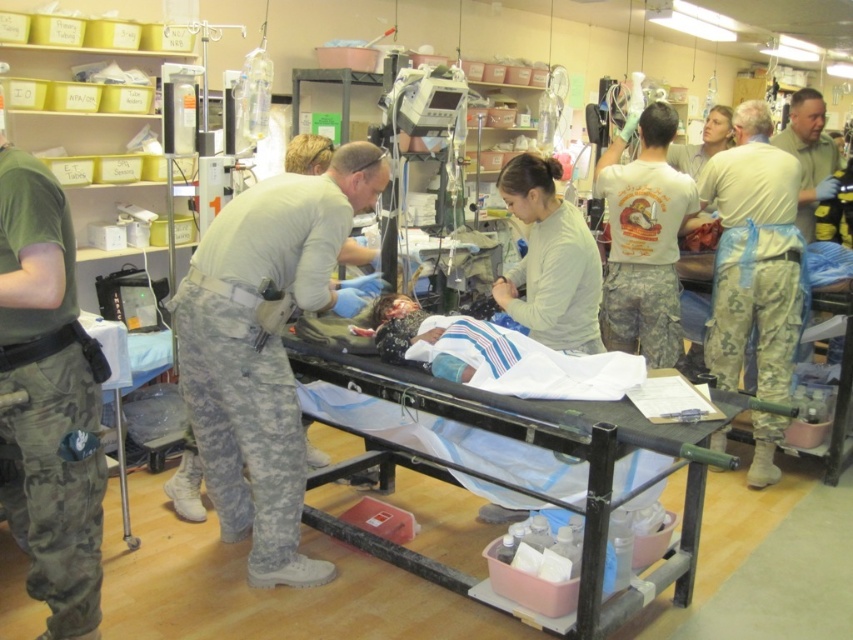
Which is above, green camouflage pants at left or black matte stretcher at center?

green camouflage pants at left is higher up.

Is green camouflage pants at left taller than black matte stretcher at center?

Indeed, green camouflage pants at left has a greater height compared to black matte stretcher at center.

Is point (15, 362) closer to camera compared to point (515, 401)?

Yes, it is.

Identify the location of green camouflage pants at left. (49, 397).

Is black matte stretcher at center to the right of light beige uniform at right from the viewer's perspective?

No, black matte stretcher at center is not to the right of light beige uniform at right.

From the picture: Is the position of black matte stretcher at center less distant than that of light beige uniform at right?

Yes.

Is point (596, 428) positioned before point (790, 164)?

Yes, point (596, 428) is closer to viewer.

The width and height of the screenshot is (853, 640). I want to click on black matte stretcher at center, so click(x=517, y=438).

Between green camouflage pants at left and green uniform at upper right, which one has less height?

Standing shorter between the two is green uniform at upper right.

Does green camouflage pants at left appear on the right side of green uniform at upper right?

Incorrect, green camouflage pants at left is not on the right side of green uniform at upper right.

Which is behind, point (19, 426) or point (822, 188)?

The point (822, 188) is behind.

You are a GUI agent. You are given a task and a screenshot of the screen. Output one action in this format:
    pyautogui.click(x=<x>, y=<y>)
    Task: Click on the green camouflage pants at left
    
    Given the screenshot: What is the action you would take?
    coord(49,397)